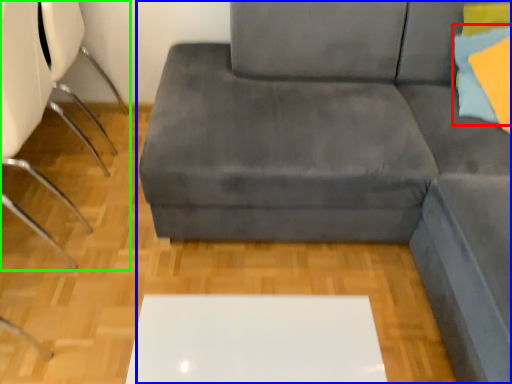
Question: Which is farther away from pillow (highlighted by a red box)? studio couch (highlighted by a blue box) or chair (highlighted by a green box)?

Choices:
 (A) studio couch
 (B) chair

Answer: (B)